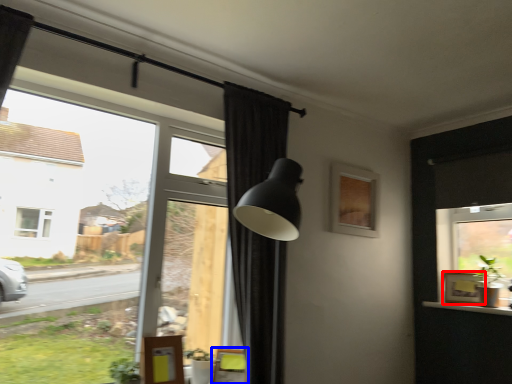
Question: Which of the following is the closest to the observer, picture frame (highlighted by a red box) or swivel chair (highlighted by a blue box)?

Choices:
 (A) picture frame
 (B) swivel chair

Answer: (B)